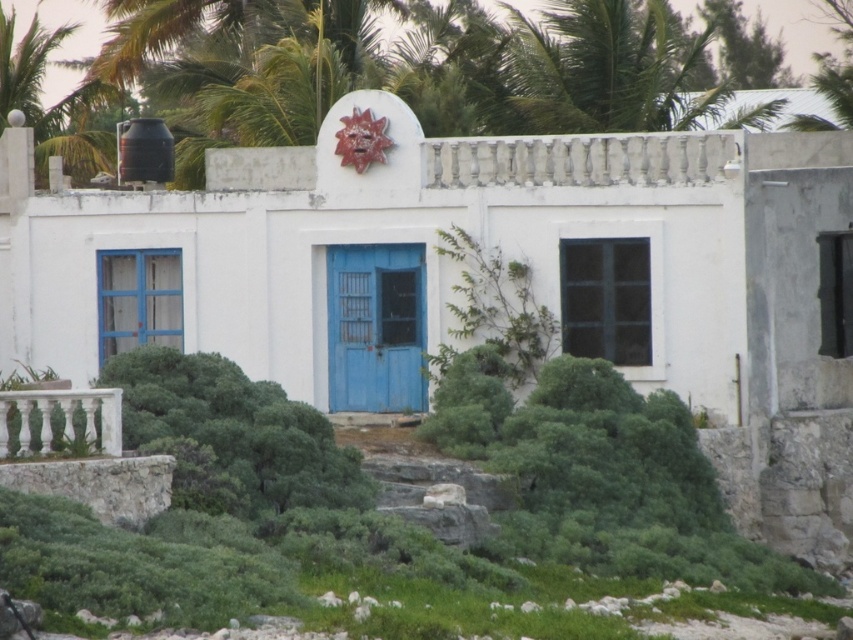
Based on the photo, between green leafy bush at center and blue matte door at center, which one has less height?

Standing shorter between the two is green leafy bush at center.

Is green leafy bush at center to the right of blue matte door at center from the viewer's perspective?

No, green leafy bush at center is not to the right of blue matte door at center.

What do you see at coordinates (236, 428) in the screenshot?
I see `green leafy bush at center` at bounding box center [236, 428].

Where is `green leafy bush at center`? green leafy bush at center is located at coordinates (236, 428).

Who is shorter, green leafy bush at center or blue painted wood door at left?

green leafy bush at center

Between point (195, 358) and point (107, 349), which one is positioned behind?

The point (107, 349) is behind.

Where is `green leafy bush at center`? green leafy bush at center is located at coordinates (236, 428).

Where is `green leafy bush at center`? The width and height of the screenshot is (853, 640). green leafy bush at center is located at coordinates (236, 428).

Between blue matte door at center and blue painted wood door at left, which one appears on the left side from the viewer's perspective?

blue painted wood door at left is more to the left.

Does blue matte door at center have a larger size compared to blue painted wood door at left?

Indeed, blue matte door at center has a larger size compared to blue painted wood door at left.

Between point (363, 397) and point (112, 256), which one is positioned in front?

Point (363, 397) is more forward.

Identify the location of blue matte door at center. The image size is (853, 640). (375, 326).